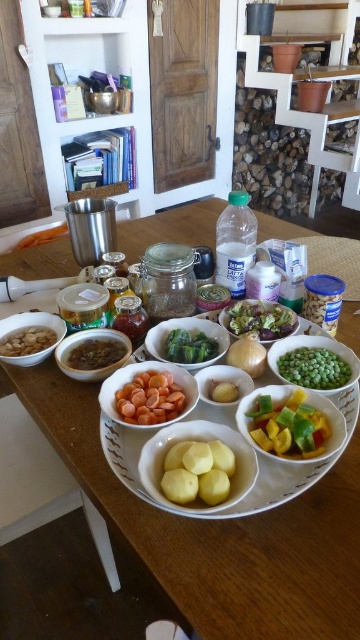
Question: Does yellow matte potatoes at center have a lesser width compared to matte brown soup at center-left?

Choices:
 (A) no
 (B) yes

Answer: (B)

Question: Among these objects, which one is nearest to the camera?

Choices:
 (A) brown matte nuts at left
 (B) matte white bowl at center-left
 (C) matte white bowl at center

Answer: (C)

Question: Does matte white bowl at center-left come in front of white matte onion at center?

Choices:
 (A) no
 (B) yes

Answer: (A)

Question: Estimate the real-world distances between objects in this image. Which object is closer to the wooden table at center?

Choices:
 (A) sliced yellow and green bell peppers at center
 (B) orange translucent carrots at center
 (C) green matte cucumber at center

Answer: (C)

Question: Which object appears closest to the camera in this image?

Choices:
 (A) brown paste at center
 (B) white matte potatoes at center

Answer: (B)

Question: Can you confirm if wooden table at center is thinner than matte white bowl at center-left?

Choices:
 (A) no
 (B) yes

Answer: (A)